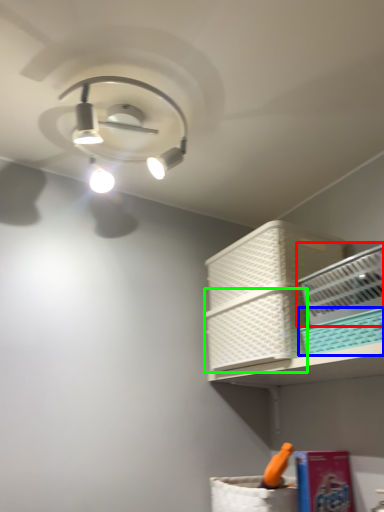
Question: Which object is the closest to the basket (highlighted by a red box)? Choose among these: basket (highlighted by a blue box) or basket (highlighted by a green box).

Choices:
 (A) basket
 (B) basket

Answer: (A)